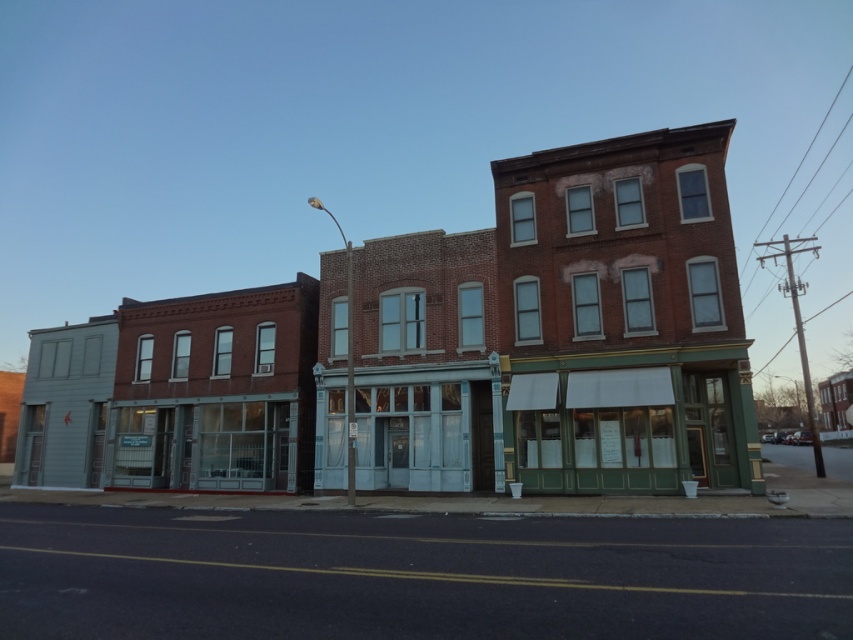
Question: Does brick building at center lie behind clear glass storefront at center?

Choices:
 (A) yes
 (B) no

Answer: (B)

Question: Which point is farther to the camera?

Choices:
 (A) (276, 438)
 (B) (730, 253)
 (C) (408, 445)
 (D) (544, 387)

Answer: (A)

Question: Based on their relative distances, which object is nearer to the clear glass storefront at center?

Choices:
 (A) white glass storefront at center
 (B) brick building at center
 (C) green painted wood storefront at center

Answer: (A)

Question: Which object is the farthest from the white glass storefront at center?

Choices:
 (A) brick building at center
 (B) green painted wood storefront at center
 (C) clear glass storefront at center

Answer: (B)

Question: Does green painted wood storefront at center come in front of white glass storefront at center?

Choices:
 (A) no
 (B) yes

Answer: (B)

Question: Can you confirm if brick building at center is bigger than green painted wood storefront at center?

Choices:
 (A) no
 (B) yes

Answer: (B)